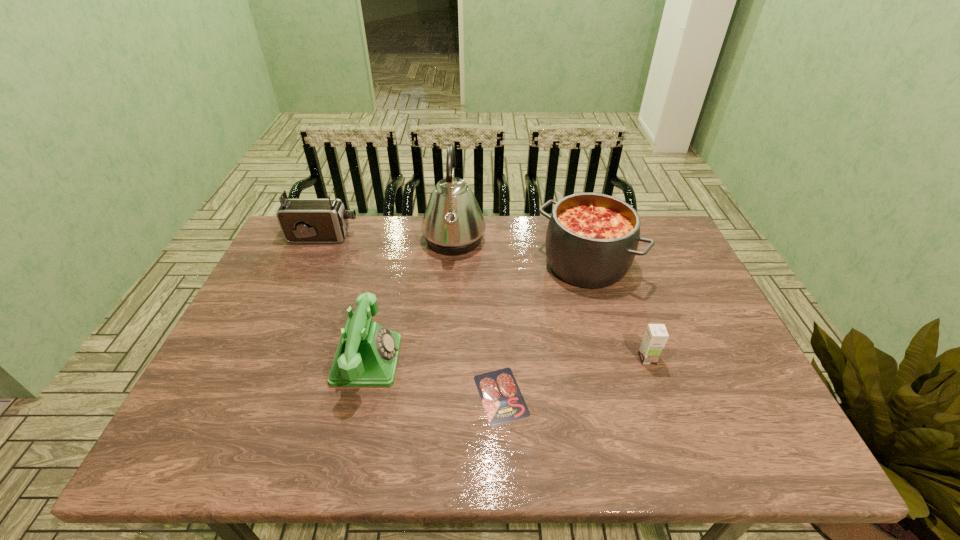
The image size is (960, 540). In order to click on free space in the image that satisfies the following two spatial constraints: 1. at the lens of the leftmost object; 2. on the left side of the casserole in this screenshot , I will do `click(311, 264)`.

This screenshot has height=540, width=960. I want to click on free location that satisfies the following two spatial constraints: 1. at the lens of the camcorder; 2. on the back side of the second shortest object, so click(x=270, y=359).

Where is `free location that satisfies the following two spatial constraints: 1. on the back side of the shortest object; 2. at the lens of the camcorder`? The image size is (960, 540). free location that satisfies the following two spatial constraints: 1. on the back side of the shortest object; 2. at the lens of the camcorder is located at coordinates (494, 237).

This screenshot has height=540, width=960. What are the coordinates of `blank area in the image that satisfies the following two spatial constraints: 1. on the back side of the shortest object; 2. on the right side of the second shortest object` in the screenshot? It's located at (499, 359).